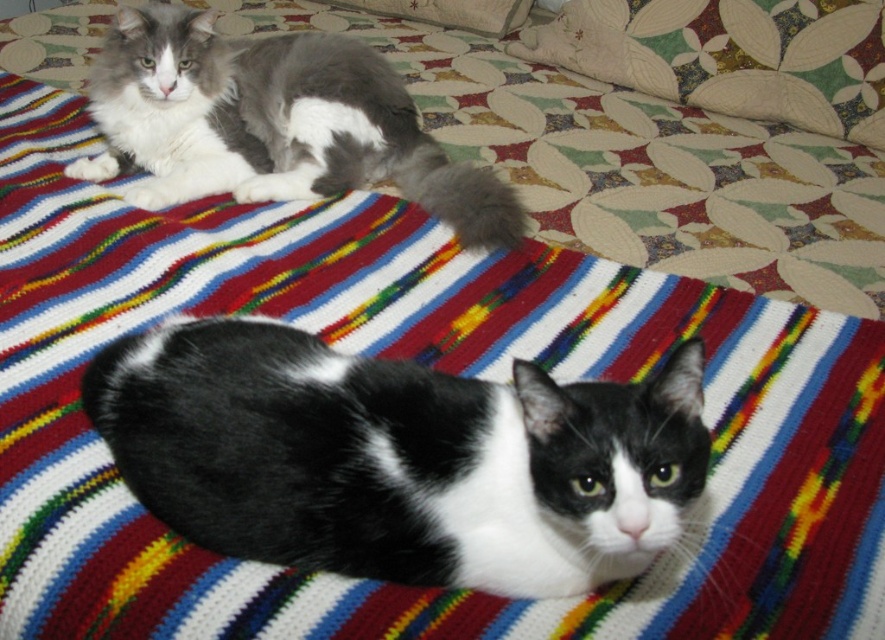
Question: Which object appears closest to the camera in this image?

Choices:
 (A) fluffy white pillow at upper right
 (B) black and white fur cat at lower center

Answer: (B)

Question: Is black and white fur cat at lower center thinner than gray and white fur cat at upper left?

Choices:
 (A) no
 (B) yes

Answer: (B)

Question: Estimate the real-world distances between objects in this image. Which object is farther from the black and white fur cat at lower center?

Choices:
 (A) gray and white fur cat at upper left
 (B) fluffy white pillow at upper right

Answer: (B)

Question: Is black and white fur cat at lower center below fluffy white pillow at upper right?

Choices:
 (A) no
 (B) yes

Answer: (B)

Question: From the image, what is the correct spatial relationship of black and white fur cat at lower center in relation to fluffy white pillow at upper right?

Choices:
 (A) left
 (B) right

Answer: (A)

Question: Which of the following is the farthest from the observer?

Choices:
 (A) (872, 38)
 (B) (144, 115)
 (C) (152, 436)

Answer: (A)